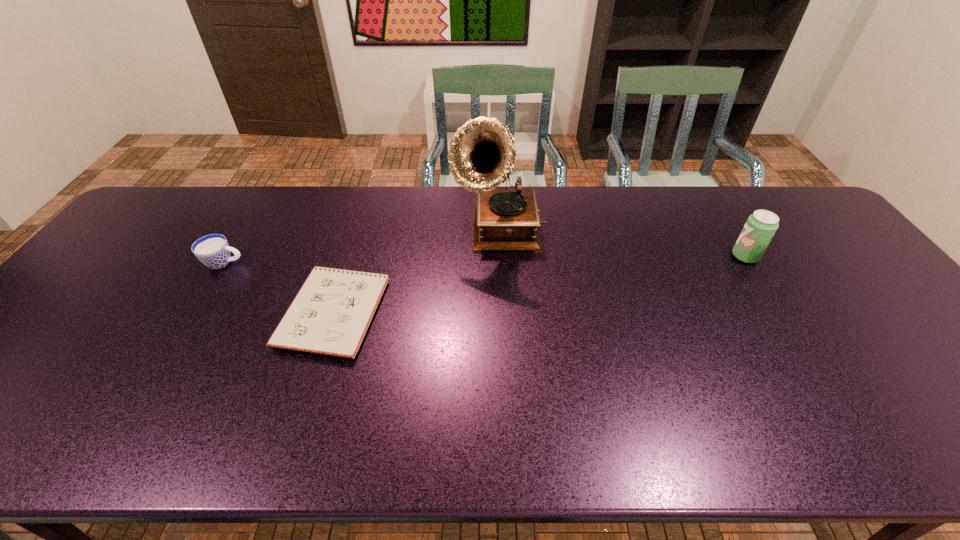
Where is `free space in the image that satisfies the following two spatial constraints: 1. on the horn of the third object from left to right; 2. on the side of the cup with the handle`? free space in the image that satisfies the following two spatial constraints: 1. on the horn of the third object from left to right; 2. on the side of the cup with the handle is located at coordinates (500, 262).

Locate an element on the screen. This screenshot has height=540, width=960. vacant area in the image that satisfies the following two spatial constraints: 1. on the side of the notepad with the handle; 2. on the right side of the cup is located at coordinates (196, 310).

Image resolution: width=960 pixels, height=540 pixels. I want to click on free location that satisfies the following two spatial constraints: 1. on the front side of the third shortest object; 2. on the side of the leftmost object with the handle, so click(749, 262).

The height and width of the screenshot is (540, 960). Find the location of `free space that satisfies the following two spatial constraints: 1. on the front side of the soda; 2. on the side of the third tallest object with the handle`. free space that satisfies the following two spatial constraints: 1. on the front side of the soda; 2. on the side of the third tallest object with the handle is located at coordinates (749, 262).

What are the coordinates of `free space that satisfies the following two spatial constraints: 1. on the front side of the rightmost object; 2. on the side of the cup with the handle` in the screenshot? It's located at (749, 262).

Locate an element on the screen. vacant area that satisfies the following two spatial constraints: 1. on the horn of the tallest object; 2. on the right side of the third shortest object is located at coordinates (500, 256).

Locate an element on the screen. This screenshot has height=540, width=960. blank space that satisfies the following two spatial constraints: 1. on the horn of the record player; 2. on the left side of the third shortest object is located at coordinates (500, 256).

Find the location of a particular element. This screenshot has width=960, height=540. free space that satisfies the following two spatial constraints: 1. on the front side of the rightmost object; 2. on the side of the second shortest object with the handle is located at coordinates (749, 262).

Locate an element on the screen. The image size is (960, 540). free space in the image that satisfies the following two spatial constraints: 1. on the side of the cup with the handle; 2. on the right side of the second object from left to right is located at coordinates click(x=196, y=310).

Locate an element on the screen. This screenshot has width=960, height=540. blank area in the image that satisfies the following two spatial constraints: 1. on the side of the shortest object with the handle; 2. on the right side of the cup is located at coordinates (196, 310).